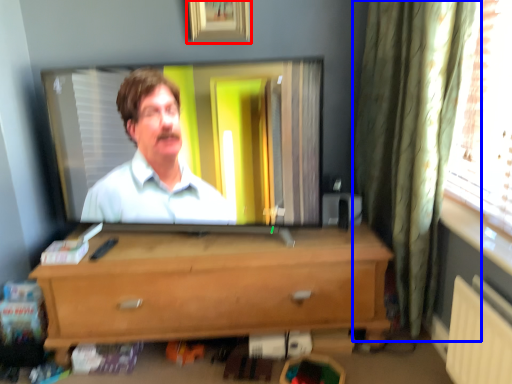
Question: Which of the following is the farthest to the observer, picture frame (highlighted by a red box) or curtain (highlighted by a blue box)?

Choices:
 (A) picture frame
 (B) curtain

Answer: (A)